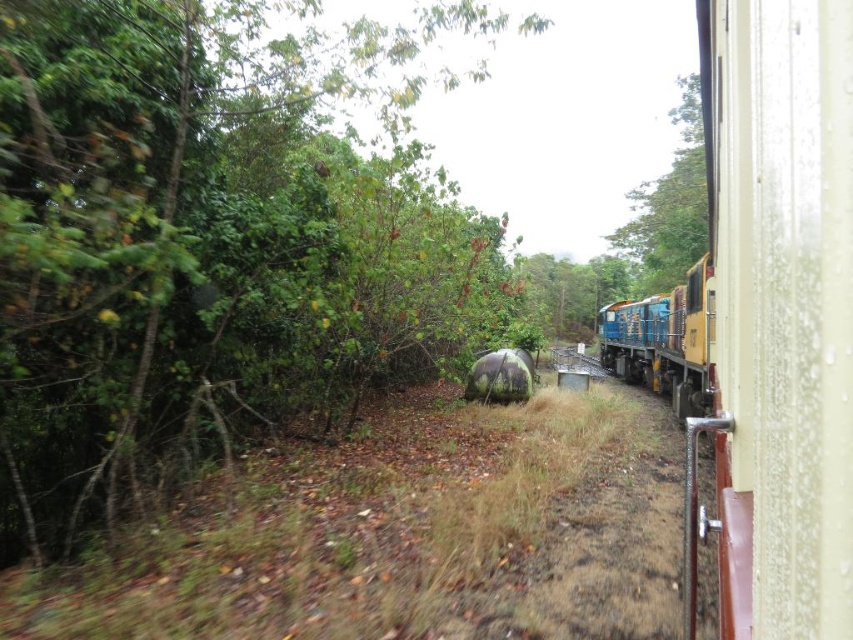
Who is taller, blue metallic train at right or green leafy tree at upper center?

With more height is green leafy tree at upper center.

At what (x,y) coordinates should I click in order to perform the action: click on blue metallic train at right. Please return your answer as a coordinate pair (x, y). Looking at the image, I should click on pos(664,342).

Can you confirm if green leafy tree at left is wider than brown dirt track at center?

Indeed, green leafy tree at left has a greater width compared to brown dirt track at center.

From the picture: Between green leafy tree at left and brown dirt track at center, which one has more height?

green leafy tree at left is taller.

Between point (28, 477) and point (483, 512), which one is positioned behind?

The point (28, 477) is behind.

You are a GUI agent. You are given a task and a screenshot of the screen. Output one action in this format:
    pyautogui.click(x=<x>, y=<y>)
    Task: Click on the green leafy tree at left
    
    Given the screenshot: What is the action you would take?
    pyautogui.click(x=216, y=237)

Is green leafy tree at left taller than green leafy tree at upper center?

Yes, green leafy tree at left is taller than green leafy tree at upper center.

Is green leafy tree at left shorter than green leafy tree at upper center?

No, green leafy tree at left is not shorter than green leafy tree at upper center.

Is point (7, 268) positioned behind point (646, 195)?

No.

You are a GUI agent. You are given a task and a screenshot of the screen. Output one action in this format:
    pyautogui.click(x=<x>, y=<y>)
    Task: Click on the green leafy tree at left
    
    Given the screenshot: What is the action you would take?
    pyautogui.click(x=216, y=237)